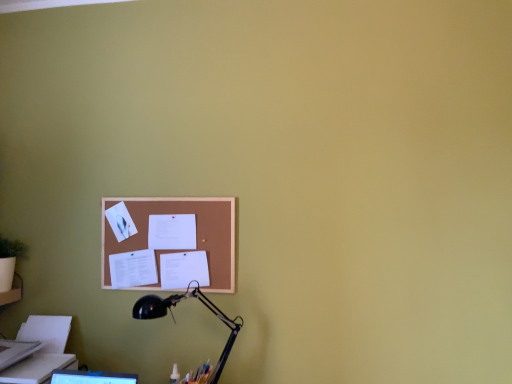
Question: In terms of width, does white paper at lower left look wider or thinner when compared to white paper at center?

Choices:
 (A) wide
 (B) thin

Answer: (A)

Question: Is white paper at lower left taller or shorter than white paper at center?

Choices:
 (A) tall
 (B) short

Answer: (A)

Question: Which object is positioned closest to the white paper at center?

Choices:
 (A) black metal lamp at lower left
 (B) corkboard at center
 (C) white paper at lower left

Answer: (B)

Question: Estimate the real-world distances between objects in this image. Which object is closer to the white paper at center?

Choices:
 (A) corkboard at center
 (B) white paper at lower left
 (C) black metal lamp at lower left

Answer: (A)